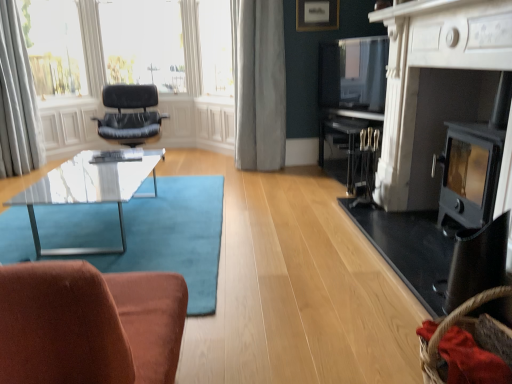
Question: Considering the positions of matte black fireplace at right, which is the first fireplace in front-to-back order, and teal carpet at center in the image, is matte black fireplace at right, which is the first fireplace in front-to-back order, bigger or smaller than teal carpet at center?

Choices:
 (A) small
 (B) big

Answer: (B)

Question: From a real-world perspective, relative to teal carpet at center, is matte black fireplace at right, which is the first fireplace in front-to-back order, vertically above or below?

Choices:
 (A) above
 (B) below

Answer: (A)

Question: Based on their relative distances, which object is nearer to the black metal fireplace at right, the 2th fireplace when ordered from front to back?

Choices:
 (A) matte black fireplace at right, which is the first fireplace in front-to-back order
 (B) clear glass window at upper center
 (C) black leather chair at upper left
 (D) brown woven basket at lower right
 (E) white sheer curtain at upper left, which is the 1th curtain from left to right

Answer: (A)

Question: Estimate the real-world distances between objects in this image. Which object is closer to the transparent glass coffee table at lower left?

Choices:
 (A) black leather chair at upper left
 (B) teal carpet at center
 (C) black metal fireplace at right, the 1th fireplace in the back-to-front sequence
 (D) matte black fireplace at right, which is the first fireplace in front-to-back order
 (E) white sheer curtains at upper left

Answer: (B)